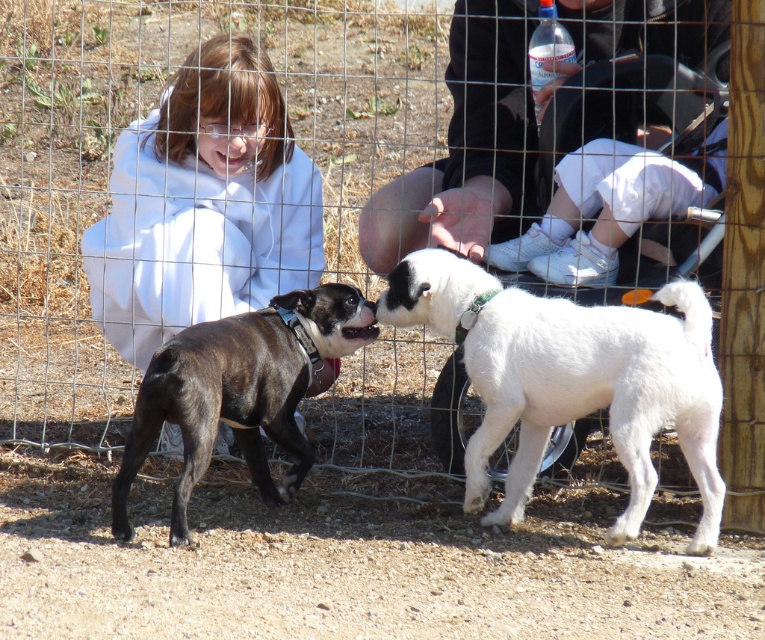
Question: Which of the following is the closest to the observer?

Choices:
 (A) black brindle dog at center
 (B) white fluffy dog at center

Answer: (B)

Question: Which object is closer to the camera taking this photo?

Choices:
 (A) white fluffy dog at center
 (B) black brindle dog at center
 (C) black fabric pants at lower center

Answer: (A)

Question: Which of the following is the farthest from the observer?

Choices:
 (A) black brindle dog at center
 (B) white clothed child at left
 (C) white fluffy dog at center

Answer: (B)

Question: Is black fabric pants at lower center above black brindle dog at center?

Choices:
 (A) yes
 (B) no

Answer: (A)

Question: Can you confirm if black fabric pants at lower center is smaller than black brindle dog at center?

Choices:
 (A) yes
 (B) no

Answer: (B)

Question: Is black fabric pants at lower center above black brindle dog at center?

Choices:
 (A) no
 (B) yes

Answer: (B)